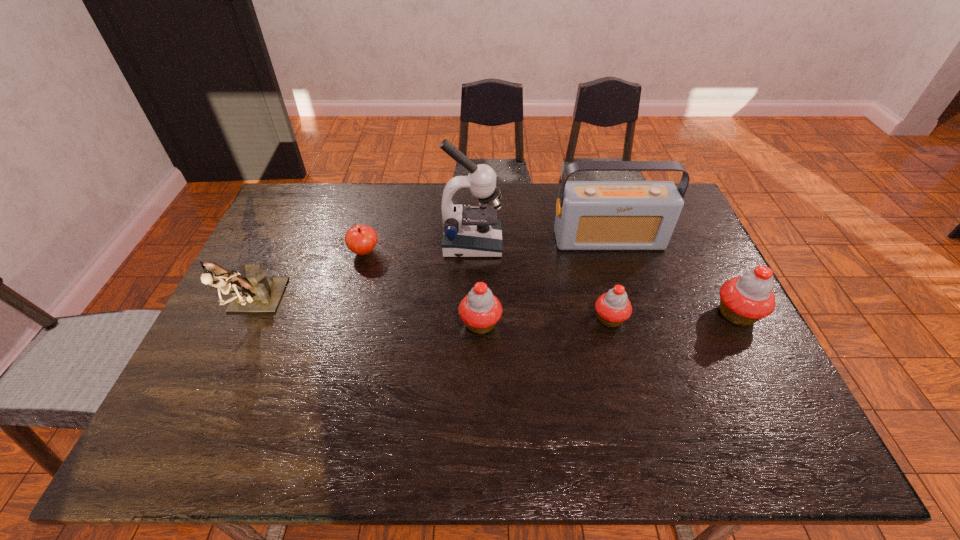
At what (x,y) coordinates should I click in order to perform the action: click on vacant region at the far edge of the desktop. Please return your answer as a coordinate pair (x, y). Looking at the image, I should click on (381, 206).

Image resolution: width=960 pixels, height=540 pixels. In the image, there is a desktop. What are the coordinates of `vacant space at the near edge` in the screenshot? It's located at (326, 386).

Find the location of `vacant position at the right edge of the desktop`. vacant position at the right edge of the desktop is located at coordinates (701, 308).

Find the location of `vacant region at the far left corner of the desktop`. vacant region at the far left corner of the desktop is located at coordinates (317, 213).

This screenshot has height=540, width=960. I want to click on free space between the leftmost object and the second tallest cupcake, so click(x=367, y=315).

I want to click on vacant area between the second tallest cupcake and the leftmost object, so click(x=367, y=315).

You are a GUI agent. You are given a task and a screenshot of the screen. Output one action in this format:
    pyautogui.click(x=<x>, y=<y>)
    Task: Click on the blank region between the microscope and the rightmost cupcake
    Image resolution: width=960 pixels, height=540 pixels.
    Given the screenshot: What is the action you would take?
    pyautogui.click(x=605, y=279)

The height and width of the screenshot is (540, 960). What are the coordinates of `empty space that is in between the apple and the second tallest cupcake` in the screenshot? It's located at (422, 288).

Find the location of a particular element. free space between the second shortest object and the apple is located at coordinates (487, 285).

The height and width of the screenshot is (540, 960). I want to click on vacant point located between the leftmost cupcake and the radio receiver, so click(x=544, y=282).